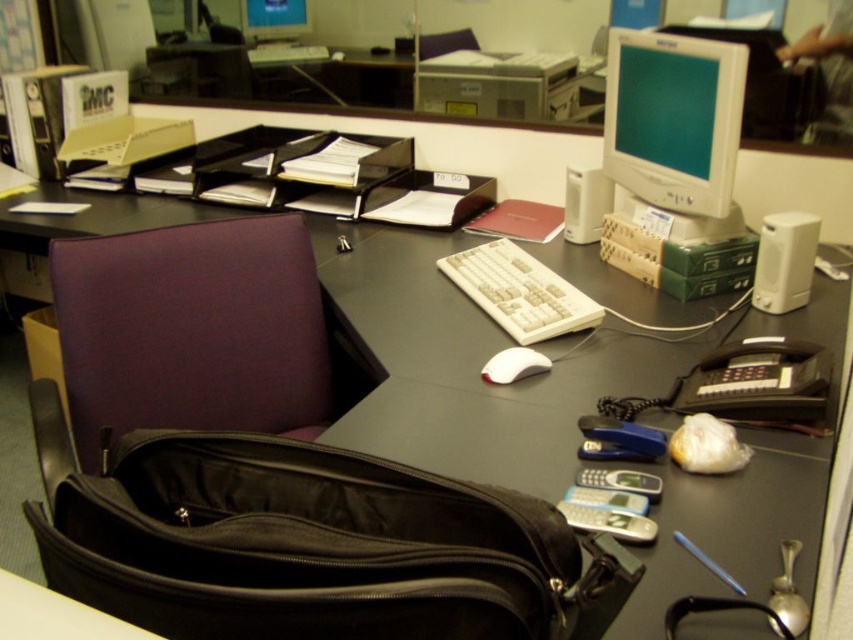
Is matte plastic monitor at upper center smaller than white matte keyboard at center?

No, matte plastic monitor at upper center is not smaller than white matte keyboard at center.

Describe the element at coordinates (274, 19) in the screenshot. I see `matte plastic monitor at upper center` at that location.

Image resolution: width=853 pixels, height=640 pixels. I want to click on matte plastic monitor at upper center, so click(274, 19).

Is white plastic keyboard at center taller than white matte keyboard at center?

Indeed, white plastic keyboard at center has a greater height compared to white matte keyboard at center.

Between point (466, 285) and point (310, 54), which one is positioned behind?

The point (310, 54) is more distant.

Locate an element on the screen. The width and height of the screenshot is (853, 640). white plastic keyboard at center is located at coordinates (519, 291).

Which is below, white plastic keyboard at center or matte plastic monitor at upper center?

white plastic keyboard at center is below.

The image size is (853, 640). I want to click on white plastic keyboard at center, so click(x=519, y=291).

Where is `white plastic keyboard at center`? white plastic keyboard at center is located at coordinates (519, 291).